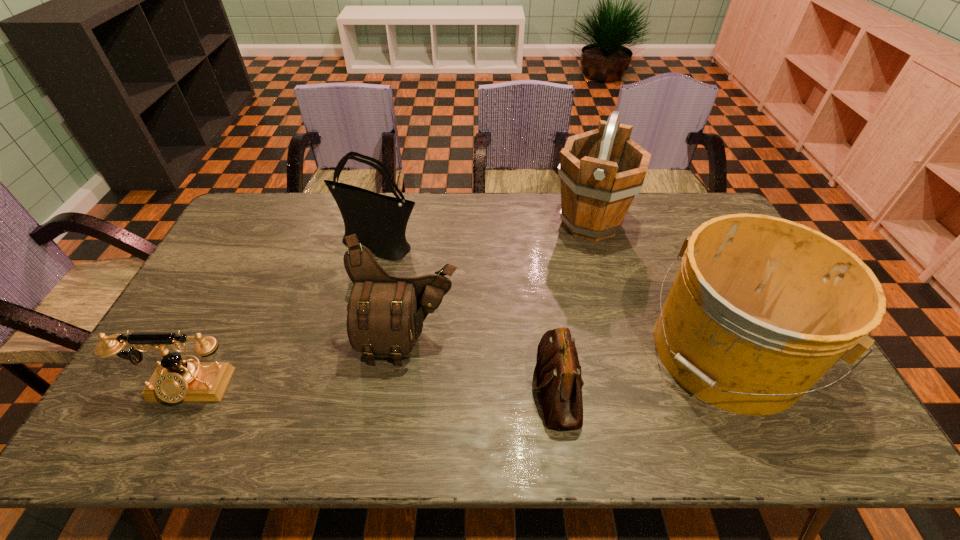
In order to click on vacant region at the left edge of the desktop in this screenshot , I will do `click(145, 409)`.

Where is `free space at the far right corner of the desktop`? The image size is (960, 540). free space at the far right corner of the desktop is located at coordinates (693, 213).

Find the location of `free space that is in between the shorter bucket and the farthest shoulder bag`. free space that is in between the shorter bucket and the farthest shoulder bag is located at coordinates (552, 299).

Where is `unoccupied position between the leftmost object and the rightmost shoulder bag`? Image resolution: width=960 pixels, height=540 pixels. unoccupied position between the leftmost object and the rightmost shoulder bag is located at coordinates (372, 387).

The width and height of the screenshot is (960, 540). Identify the location of free space between the rightmost shoulder bag and the shorter bucket. (641, 369).

This screenshot has height=540, width=960. What are the coordinates of `empty space between the leftmost object and the shorter bucket` in the screenshot? It's located at (457, 369).

Where is `free space between the rightmost shoulder bag and the shorter bucket`? This screenshot has height=540, width=960. free space between the rightmost shoulder bag and the shorter bucket is located at coordinates (641, 369).

Identify which object is located as the third nearest to the shorter bucket. Please provide its 2D coordinates. Your answer should be formatted as a tuple, i.e. [(x, y)], where the tuple contains the x and y coordinates of a point satisfying the conditions above.

[(385, 316)]

This screenshot has height=540, width=960. In order to click on object that stands as the second closest to the farthest shoulder bag in this screenshot , I will do (x=175, y=380).

Identify the location of shoulder bag object that ranks as the second closest to the tallest object. The height and width of the screenshot is (540, 960). tap(385, 316).